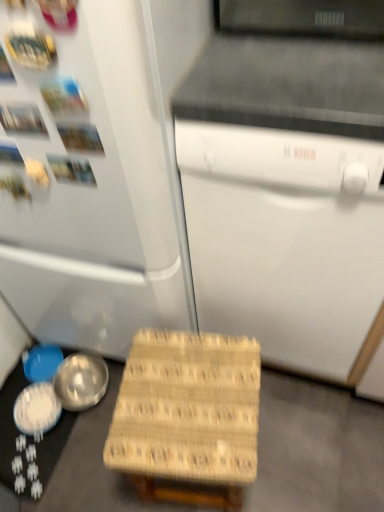
Question: Does white matte refrigerator at left have a lesser width compared to shiny metallic bowl at lower left, the third bowl when ordered from left to right?

Choices:
 (A) no
 (B) yes

Answer: (A)

Question: Considering the relative positions of white matte refrigerator at left and shiny metallic bowl at lower left, which is the 1th bowl from right to left, in the image provided, is white matte refrigerator at left to the right of shiny metallic bowl at lower left, which is the 1th bowl from right to left, from the viewer's perspective?

Choices:
 (A) no
 (B) yes

Answer: (B)

Question: Is white matte refrigerator at left behind shiny metallic bowl at lower left, the third bowl when ordered from left to right?

Choices:
 (A) yes
 (B) no

Answer: (B)

Question: From a real-world perspective, is white matte refrigerator at left below shiny metallic bowl at lower left, which is the 1th bowl from right to left?

Choices:
 (A) yes
 (B) no

Answer: (B)

Question: Is white matte refrigerator at left wider than shiny metallic bowl at lower left, which is the 1th bowl from right to left?

Choices:
 (A) no
 (B) yes

Answer: (B)

Question: Looking at the image, does white matte dishwasher at center seem bigger or smaller compared to woven wood step stool at lower center?

Choices:
 (A) small
 (B) big

Answer: (B)

Question: Is white matte dishwasher at center to the left or to the right of woven wood step stool at lower center in the image?

Choices:
 (A) right
 (B) left

Answer: (A)

Question: Is white matte dishwasher at center in front of or behind woven wood step stool at lower center in the image?

Choices:
 (A) behind
 (B) front

Answer: (B)

Question: Is white matte dishwasher at center spatially inside woven wood step stool at lower center, or outside of it?

Choices:
 (A) outside
 (B) inside

Answer: (A)

Question: Considering the positions of point (34, 351) and point (125, 416), is point (34, 351) closer or farther from the camera than point (125, 416)?

Choices:
 (A) closer
 (B) farther

Answer: (B)

Question: From a real-world perspective, is blue matte bowl at lower left, acting as the 3th bowl starting from the right, physically located above or below woven wood step stool at lower center?

Choices:
 (A) below
 (B) above

Answer: (A)

Question: From the image's perspective, is blue matte bowl at lower left, acting as the 1th bowl starting from the left, positioned above or below woven wood step stool at lower center?

Choices:
 (A) above
 (B) below

Answer: (A)

Question: Visually, is blue matte bowl at lower left, acting as the 1th bowl starting from the left, positioned to the left or to the right of woven wood step stool at lower center?

Choices:
 (A) left
 (B) right

Answer: (A)

Question: Is shiny silver bowl at lower left, positioned as the 2th bowl in right-to-left order, taller or shorter than white matte dishwasher at center?

Choices:
 (A) tall
 (B) short

Answer: (B)

Question: Choose the correct answer: Is shiny silver bowl at lower left, positioned as the 2th bowl in right-to-left order, inside white matte dishwasher at center or outside it?

Choices:
 (A) inside
 (B) outside

Answer: (B)